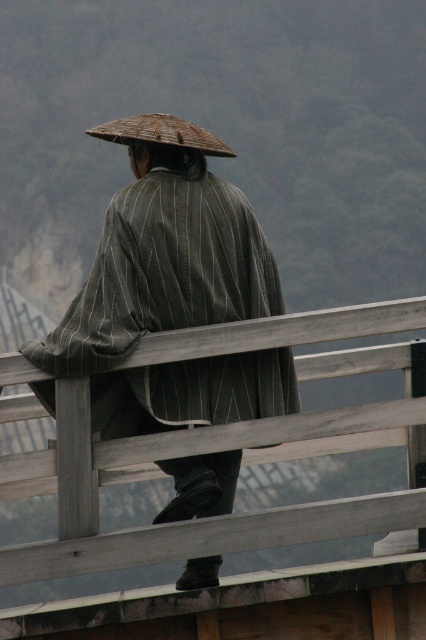
You are an anthropologist observing a cultural ceremony. You notice the striped fabric kimono at center and the brown woven straw hat at upper center. Which object is taller?

The striped fabric kimono at center is taller than the brown woven straw hat at upper center according to the description.

You are an artist trying to sketch the scene. You need to decide which object to draw first based on their sizes. Which one should you start with, the striped fabric kimono at center or the brown woven straw hat at upper center?

The striped fabric kimono at center is wider than the brown woven straw hat at upper center, so you should start with the striped fabric kimono at center because it is larger in width.

You are a photographer trying to capture the striped fabric kimono at center and the brown woven straw hat at upper center in a single shot. However, your camera has limited depth of field. Which object should you focus on to ensure the other remains in focus?

Since the striped fabric kimono at center is in front of the brown woven straw hat at upper center, focusing on the middle point between them would keep both in focus. However, if you must choose one, focus on the brown woven straw hat at upper center because it is farther away, ensuring the closer kimono remains sharp.